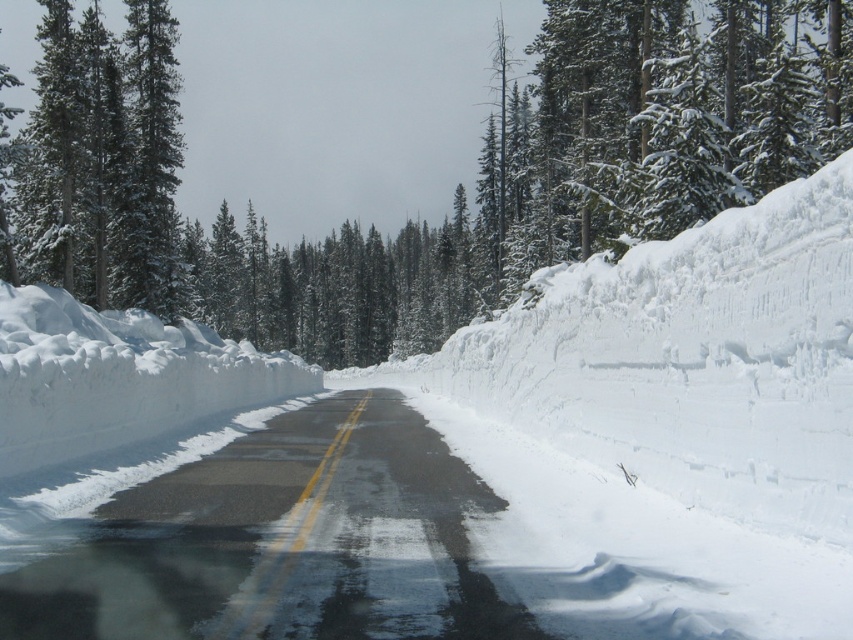
You are driving a car and see two points on the road ahead. The first point is at coordinate point(410, 444) and the second is at point(137, 227). Which point is closer to your current position?

Point(410, 444) is in front of point(137, 227), so the point closer to your current position is point(137, 227).

You are a delivery driver who needs to deliver a package to a house located near the green textured pine trees at left. Your truck has a turning radius of 15 meters. Can you safely turn around on the glossy asphalt road at center without going onto the snowbanks?

The glossy asphalt road at center is 31.19 meters away from the green textured pine trees at left. Since the truck requires a turning radius of 15 meters, it can safely turn around on the glossy asphalt road at center as the distance between them is sufficient.

You are driving a car and see the glossy asphalt road at center and the green textured pine trees at left. Which object is located to the right of the other?

The glossy asphalt road at center is positioned on the right side of green textured pine trees at left, so the glossy asphalt road at center is to the right of the green textured pine trees at left.